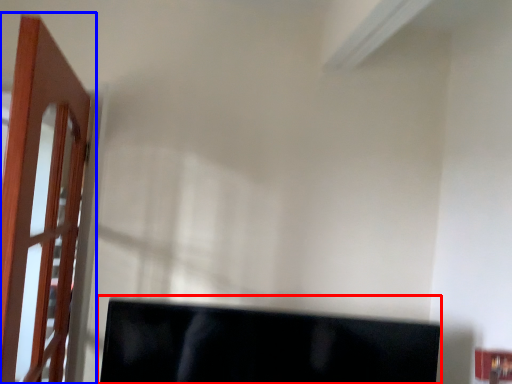
Question: Among these objects, which one is nearest to the camera, computer monitor (highlighted by a red box) or door (highlighted by a blue box)?

Choices:
 (A) computer monitor
 (B) door

Answer: (B)